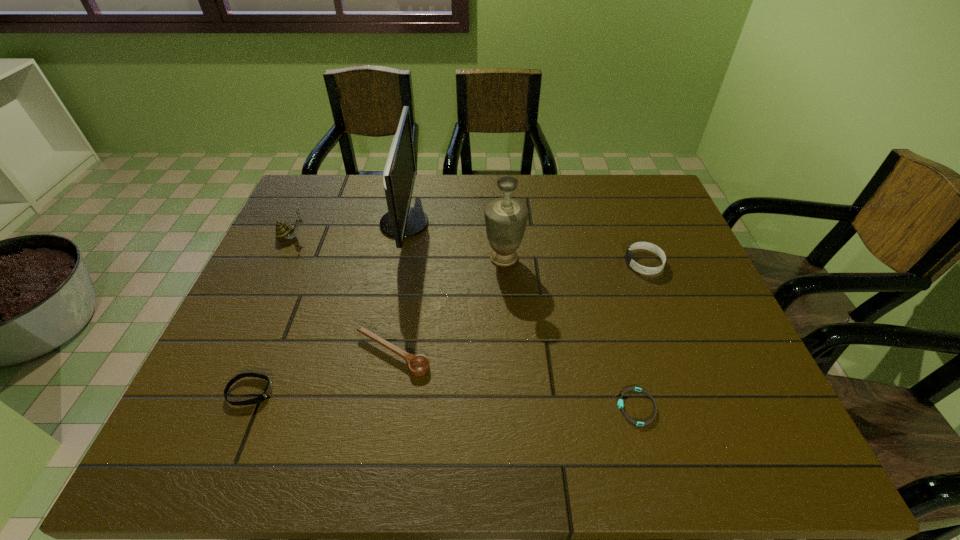
Locate an element on the screen. This screenshot has width=960, height=540. the second object from right to left is located at coordinates (620, 405).

Find the location of a particular element. The height and width of the screenshot is (540, 960). the second wristband from left to right is located at coordinates (620, 405).

I want to click on vacant space located 0.080m on the screen side of the monitor, so click(455, 224).

The image size is (960, 540). In order to click on free region located 0.250m on the front of the fifth object from left to right in this screenshot , I will do `click(509, 347)`.

I want to click on vacant space located on the face of the fifth shortest object, so click(421, 237).

This screenshot has height=540, width=960. In order to click on free space located on the outer surface of the tallest wristband in this screenshot , I will do click(539, 263).

Locate an element on the screen. This screenshot has height=540, width=960. vacant space located on the outer surface of the tallest wristband is located at coordinates (586, 263).

Find the location of a particular element. The image size is (960, 540). free location located on the outer surface of the tallest wristband is located at coordinates (546, 263).

Locate an element on the screen. The width and height of the screenshot is (960, 540). free point located on the front of the fifth farthest object is located at coordinates (379, 435).

You are a GUI agent. You are given a task and a screenshot of the screen. Output one action in this format:
    pyautogui.click(x=<x>, y=<y>)
    Task: Click on the free space located 0.120m on the display of the second shortest wristband
    This screenshot has width=960, height=540.
    Given the screenshot: What is the action you would take?
    pyautogui.click(x=328, y=392)